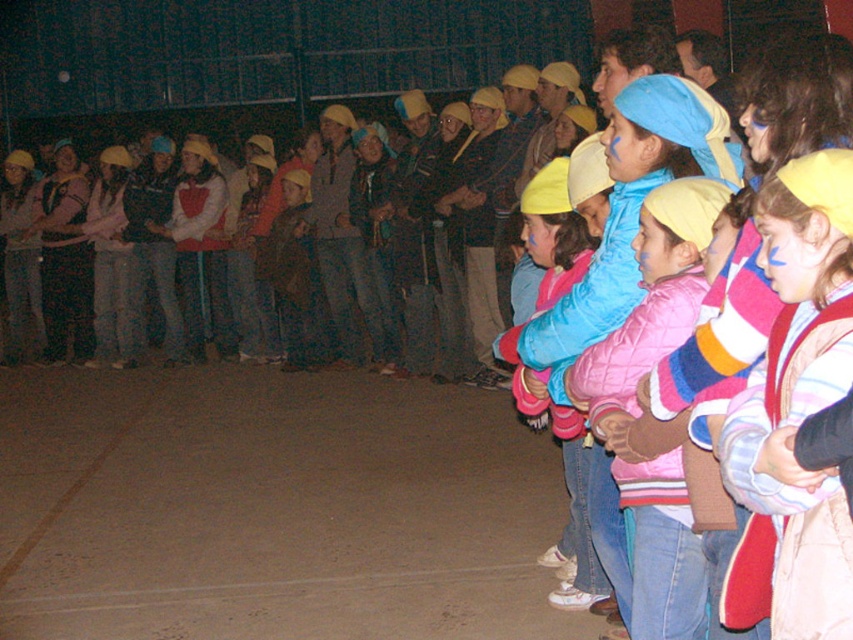
Question: Which point is farther to the camera?

Choices:
 (A) striped fleece jacket at center
 (B) pink quilted jacket at center
 (C) matte blue jacket at center

Answer: (C)

Question: Is the position of striped fleece jacket at center less distant than that of brown concrete floor at lower center?

Choices:
 (A) no
 (B) yes

Answer: (B)

Question: Does striped fleece jacket at center appear over pink quilted jacket at center?

Choices:
 (A) no
 (B) yes

Answer: (B)

Question: Is striped fleece jacket at center closer to the viewer compared to pink quilted jacket at center?

Choices:
 (A) yes
 (B) no

Answer: (A)

Question: Which object is closer to the camera taking this photo?

Choices:
 (A) pink quilted jacket at center
 (B) matte blue jacket at center

Answer: (A)

Question: Which object appears farthest from the camera in this image?

Choices:
 (A) brown concrete floor at lower center
 (B) matte blue jacket at center
 (C) striped fleece jacket at center

Answer: (A)